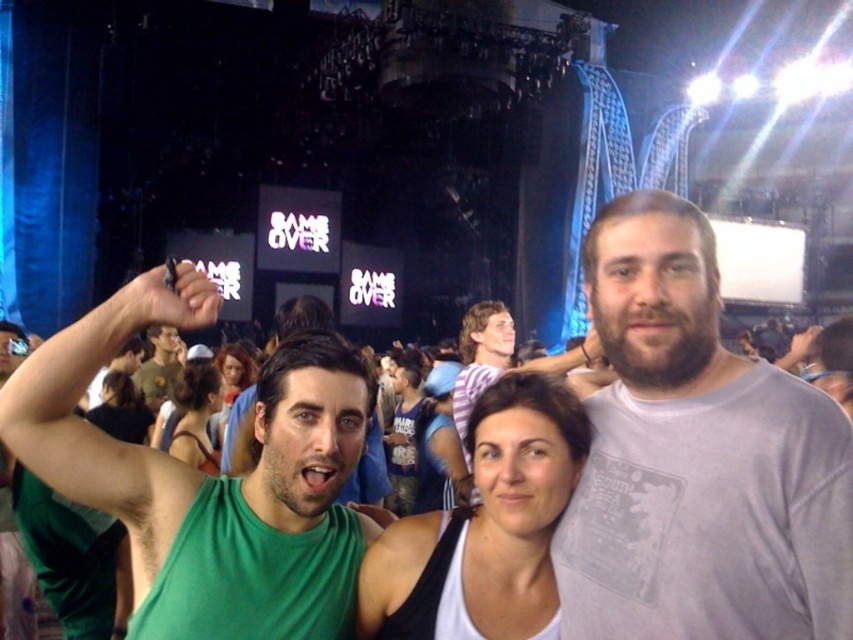
You are a photographer at the concert and want to capture a shot of the matte blue tank top at center and the smooth brown hair at center. Which object should you focus on first if you want to start from the top of the scene and work your way down?

The smooth brown hair at center should be focused on first because it is located above the matte blue tank top at center.

You are standing at the point with coordinates point (236, 371). You want to move to the stage area. Which direction should you move relative to the point (401, 500)?

To reach the stage area from point (236, 371), you should move towards point (401, 500) since it is in front of your current position.